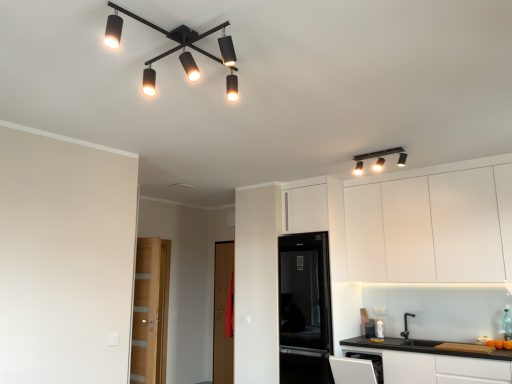
Question: From a real-world perspective, relative to light brown wooden door at left, is brown wooden door at center vertically above or below?

Choices:
 (A) below
 (B) above

Answer: (A)

Question: In terms of width, does brown wooden door at center look wider or thinner when compared to light brown wooden door at left?

Choices:
 (A) wide
 (B) thin

Answer: (B)

Question: Estimate the real-world distances between objects in this image. Which object is closer to the black glass refrigerator at center?

Choices:
 (A) matte black light fixture at upper left
 (B) light brown wooden door at left
 (C) matte black light fixture at upper right
 (D) brown wooden door at center
 (E) white matte cabinet at lower right, the 2th cabinetry from the top

Answer: (E)

Question: Estimate the real-world distances between objects in this image. Which object is farther from the matte black light fixture at upper right?

Choices:
 (A) matte black light fixture at upper left
 (B) brown wooden door at center
 (C) white matte cabinet at upper right, which ranks as the first cabinetry in top-to-bottom order
 (D) black glass refrigerator at center
 (E) white matte cabinet at lower right, arranged as the 1th cabinetry when ordered from the bottom

Answer: (B)